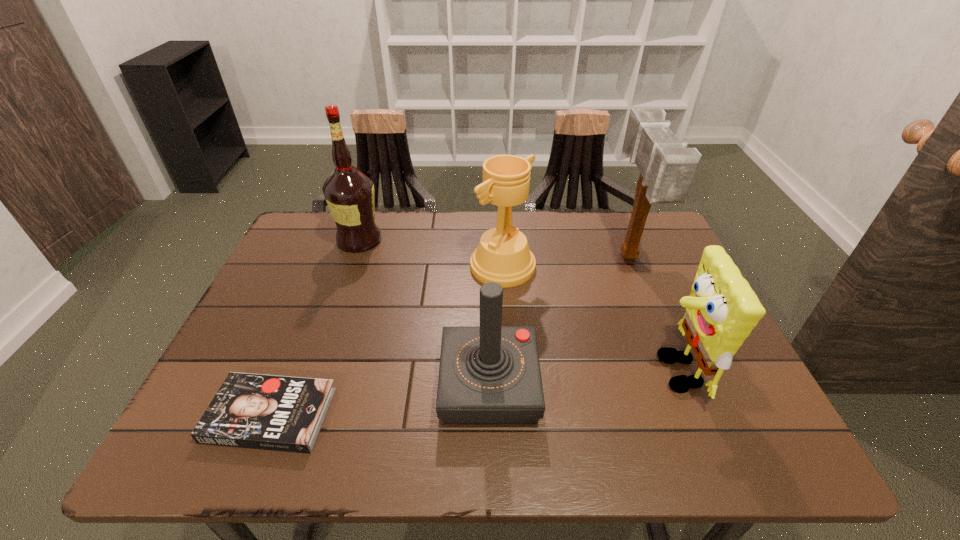
At what (x,y) coordinates should I click in order to perform the action: click on vacant point located on the face of the sponge. Please return your answer as a coordinate pair (x, y). This screenshot has height=540, width=960. Looking at the image, I should click on (541, 372).

Identify the location of vacant space located on the face of the sponge. The image size is (960, 540). click(541, 372).

Find the location of a particular element. This screenshot has width=960, height=540. vacant space located 0.390m on the rectangular base of the joystick is located at coordinates (256, 386).

This screenshot has height=540, width=960. I want to click on free space located on the rectangular base of the joystick, so click(x=398, y=386).

You are a GUI agent. You are given a task and a screenshot of the screen. Output one action in this format:
    pyautogui.click(x=<x>, y=<y>)
    Task: Click on the free space located 0.170m on the rectangular base of the joystick
    This screenshot has height=540, width=960.
    Given the screenshot: What is the action you would take?
    pyautogui.click(x=361, y=386)

This screenshot has height=540, width=960. What are the coordinates of `vacant space located 0.140m on the back of the book` in the screenshot? It's located at (303, 332).

The image size is (960, 540). I want to click on alcohol that is at the far edge, so click(x=349, y=193).

The image size is (960, 540). I want to click on mallet that is at the far edge, so click(667, 167).

The height and width of the screenshot is (540, 960). I want to click on award positioned at the far edge, so tap(503, 256).

Where is `joystick present at the near edge`? joystick present at the near edge is located at coordinates (490, 374).